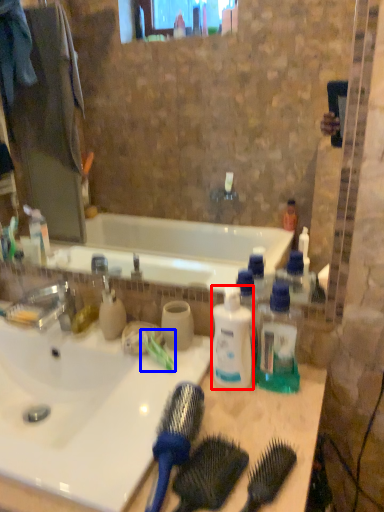
Question: Which of the following is the farthest to the observer, bottle (highlighted by a red box) or toothbrush (highlighted by a blue box)?

Choices:
 (A) bottle
 (B) toothbrush

Answer: (B)